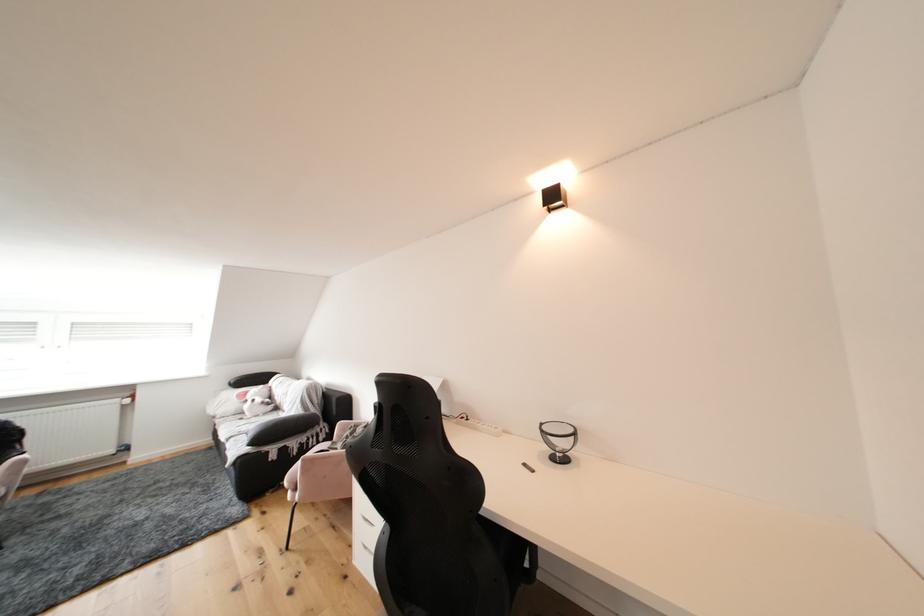
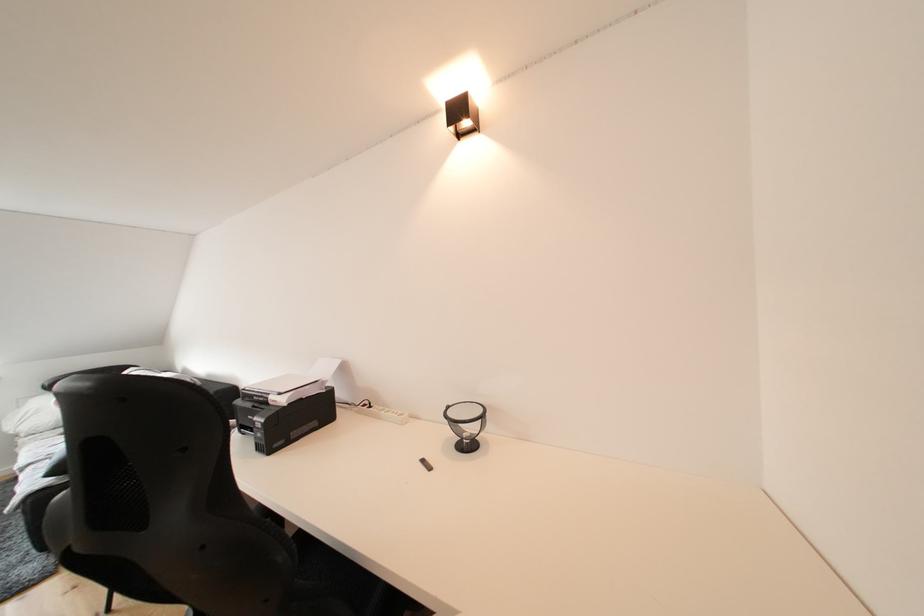
What movement of the cameraman would produce the second image?

The movement direction of the cameraman is right, forward.